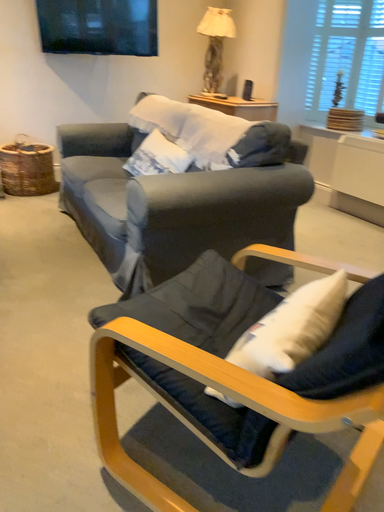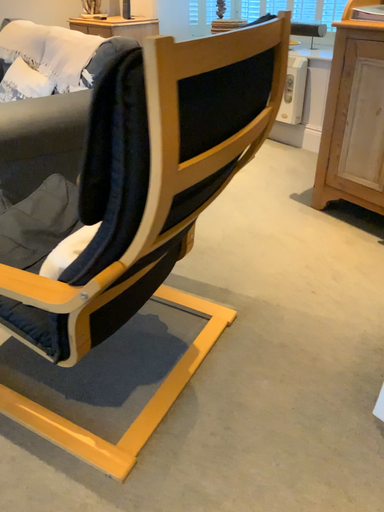
Question: How did the camera likely rotate when shooting the video?

Choices:
 (A) rotated upward
 (B) rotated downward

Answer: (B)